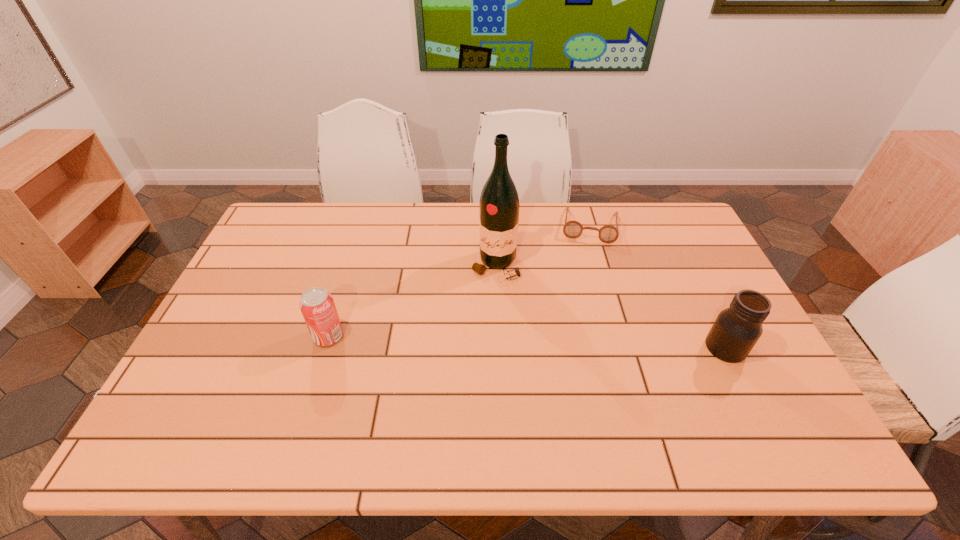
You are a GUI agent. You are given a task and a screenshot of the screen. Output one action in this format:
    pyautogui.click(x=<x>, y=<y>)
    Task: Click on the free space at the near edge of the desktop
    
    Given the screenshot: What is the action you would take?
    pyautogui.click(x=667, y=383)

I want to click on free spot at the left edge of the desktop, so click(x=243, y=323).

In the image, there is a desktop. Identify the location of vacant region at the far left corner. This screenshot has width=960, height=540. (305, 208).

The width and height of the screenshot is (960, 540). In the image, there is a desktop. Identify the location of vacant space at the near left corner. (200, 387).

The image size is (960, 540). I want to click on vacant space at the far right corner of the desktop, so click(658, 234).

Locate an element on the screen. The image size is (960, 540). vacant space that is in between the farthest object and the jar is located at coordinates (658, 287).

Where is `free space between the rightmost object and the tallest object`? free space between the rightmost object and the tallest object is located at coordinates (611, 306).

Identify the location of vacant space that is in between the leftmost object and the tallest object. The height and width of the screenshot is (540, 960). (412, 301).

Where is `vacant region between the shortest object and the rightmost object`? vacant region between the shortest object and the rightmost object is located at coordinates (658, 287).

I want to click on unoccupied area between the jar and the farthest object, so click(x=658, y=287).